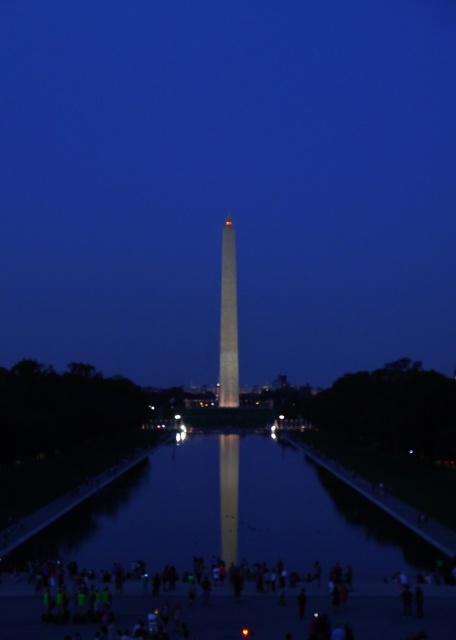
Can you confirm if glossy reflective water at center is smaller than dark clothing figure at center?

No, glossy reflective water at center is not smaller than dark clothing figure at center.

Looking at this image, can you confirm if glossy reflective water at center is thinner than dark clothing figure at center?

No.

Does point (284, 536) come behind point (26, 616)?

Yes, it is.

Where is `glossy reflective water at center`? glossy reflective water at center is located at coordinates 238,515.

Is point (257, 529) in front of point (227, 332)?

Yes, point (257, 529) is closer to viewer.

Does glossy reflective water at center appear on the right side of shiny gold obelisk at center?

Incorrect, glossy reflective water at center is not on the right side of shiny gold obelisk at center.

Is point (239, 468) farther from camera compared to point (232, 241)?

No, (239, 468) is in front of (232, 241).

The height and width of the screenshot is (640, 456). In order to click on glossy reflective water at center in this screenshot , I will do `click(238, 515)`.

How much distance is there between dark clothing figure at center and shiny gold obelisk at center?

A distance of 130.26 meters exists between dark clothing figure at center and shiny gold obelisk at center.

Is the position of dark clothing figure at center more distant than that of shiny gold obelisk at center?

No, it is in front of shiny gold obelisk at center.

Describe the element at coordinates (216, 611) in the screenshot. I see `dark clothing figure at center` at that location.

Where is `dark clothing figure at center`? dark clothing figure at center is located at coordinates (216, 611).